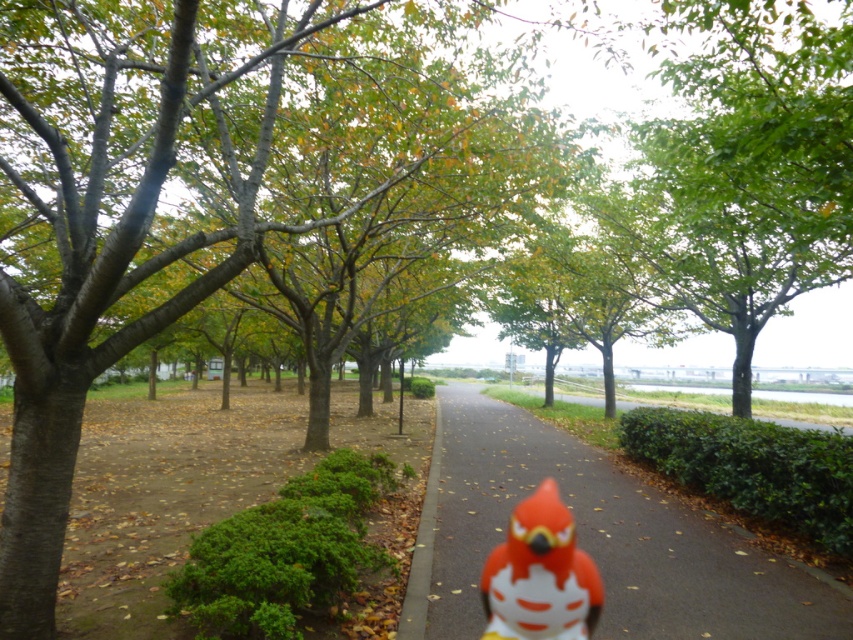
Does smooth asphalt path at center have a lesser height compared to matte orange bird at center?

No, smooth asphalt path at center is not shorter than matte orange bird at center.

Based on the photo, does smooth asphalt path at center appear under matte orange bird at center?

Indeed, smooth asphalt path at center is positioned under matte orange bird at center.

Describe the element at coordinates (604, 538) in the screenshot. I see `smooth asphalt path at center` at that location.

This screenshot has height=640, width=853. I want to click on smooth asphalt path at center, so click(x=604, y=538).